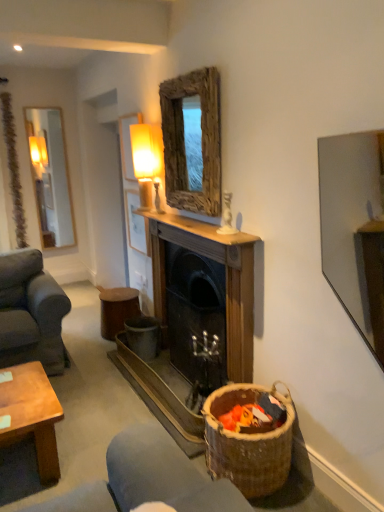
Question: From a real-world perspective, is wooden fireplace at center located beneath wooden stool at center?

Choices:
 (A) yes
 (B) no

Answer: (B)

Question: Is wooden fireplace at center in contact with wooden stool at center?

Choices:
 (A) yes
 (B) no

Answer: (B)

Question: Is wooden fireplace at center facing away from wooden stool at center?

Choices:
 (A) yes
 (B) no

Answer: (B)

Question: Does wooden fireplace at center have a larger size compared to wooden stool at center?

Choices:
 (A) yes
 (B) no

Answer: (A)

Question: Is wooden stool at center surrounded by wooden fireplace at center?

Choices:
 (A) no
 (B) yes

Answer: (A)

Question: Does point (124, 300) appear closer or farther from the camera than point (178, 227)?

Choices:
 (A) closer
 (B) farther

Answer: (B)

Question: In the image, is wooden stool at center positioned in front of or behind wooden fireplace at center?

Choices:
 (A) front
 (B) behind

Answer: (B)

Question: Is wooden stool at center taller or shorter than wooden fireplace at center?

Choices:
 (A) short
 (B) tall

Answer: (A)

Question: Looking at their shapes, would you say wooden stool at center is wider or thinner than wooden fireplace at center?

Choices:
 (A) thin
 (B) wide

Answer: (B)

Question: From their relative heights in the image, would you say matte glass lamp at upper center is taller or shorter than brown woven basket at lower right?

Choices:
 (A) tall
 (B) short

Answer: (A)

Question: From a real-world perspective, is matte glass lamp at upper center physically located above or below brown woven basket at lower right?

Choices:
 (A) above
 (B) below

Answer: (A)

Question: In terms of width, does matte glass lamp at upper center look wider or thinner when compared to brown woven basket at lower right?

Choices:
 (A) wide
 (B) thin

Answer: (B)

Question: Is matte glass lamp at upper center inside or outside of brown woven basket at lower right?

Choices:
 (A) outside
 (B) inside

Answer: (A)

Question: Based on their sizes in the image, would you say wooden fireplace at center is bigger or smaller than wooden stool at center?

Choices:
 (A) small
 (B) big

Answer: (B)

Question: Visually, is wooden fireplace at center positioned to the left or to the right of wooden stool at center?

Choices:
 (A) right
 (B) left

Answer: (A)